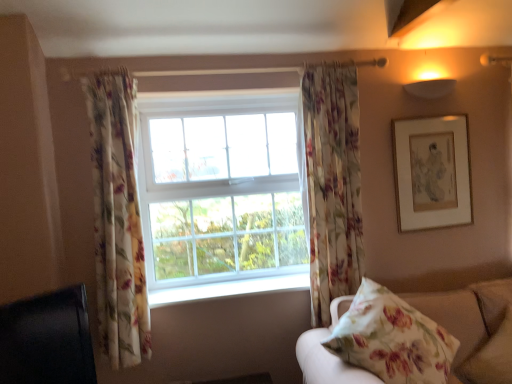
Question: Should I look upward or downward to see white glass window at center?

Choices:
 (A) down
 (B) up

Answer: (B)

Question: Is black glossy tv at lower left taller than floral fabric pillow at lower right?

Choices:
 (A) yes
 (B) no

Answer: (B)

Question: Could you tell me if black glossy tv at lower left is facing floral fabric pillow at lower right?

Choices:
 (A) yes
 (B) no

Answer: (B)

Question: Considering the relative sizes of black glossy tv at lower left and floral fabric pillow at lower right in the image provided, is black glossy tv at lower left smaller than floral fabric pillow at lower right?

Choices:
 (A) no
 (B) yes

Answer: (B)

Question: Can you confirm if black glossy tv at lower left is wider than floral fabric pillow at lower right?

Choices:
 (A) yes
 (B) no

Answer: (B)

Question: Considering the relative sizes of black glossy tv at lower left and floral fabric pillow at lower right in the image provided, is black glossy tv at lower left bigger than floral fabric pillow at lower right?

Choices:
 (A) yes
 (B) no

Answer: (B)

Question: Is black glossy tv at lower left behind floral fabric pillow at lower right?

Choices:
 (A) yes
 (B) no

Answer: (A)

Question: Does floral fabric curtain at left, positioned as the second curtain in right-to-left order, have a greater width compared to floral fabric curtain at center, arranged as the second curtain when viewed from the left?

Choices:
 (A) no
 (B) yes

Answer: (B)

Question: Is floral fabric curtain at left, positioned as the second curtain in right-to-left order, at the left side of floral fabric curtain at center, positioned as the 1th curtain in right-to-left order?

Choices:
 (A) yes
 (B) no

Answer: (A)

Question: Is floral fabric curtain at left, positioned as the second curtain in right-to-left order, bigger than floral fabric curtain at center, positioned as the 1th curtain in right-to-left order?

Choices:
 (A) no
 (B) yes

Answer: (B)

Question: Does floral fabric curtain at left, positioned as the second curtain in right-to-left order, appear on the right side of floral fabric curtain at center, positioned as the 1th curtain in right-to-left order?

Choices:
 (A) no
 (B) yes

Answer: (A)

Question: Is floral fabric curtain at left, which appears as the 1th curtain when viewed from the left, outside floral fabric curtain at center, arranged as the second curtain when viewed from the left?

Choices:
 (A) yes
 (B) no

Answer: (A)

Question: Does floral fabric curtain at left, positioned as the second curtain in right-to-left order, have a lesser height compared to floral fabric curtain at center, positioned as the 1th curtain in right-to-left order?

Choices:
 (A) no
 (B) yes

Answer: (A)